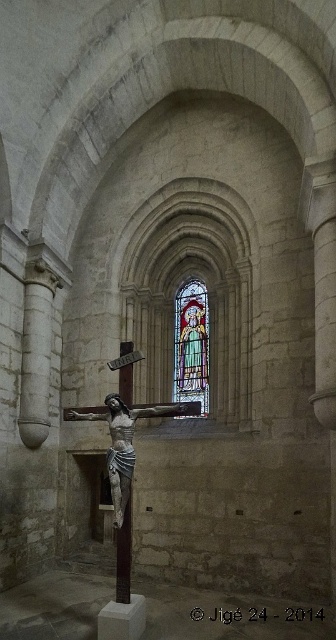
You are standing in the historic church or cathedral. You want to locate the stained glass window at center. Where should you look?

You should look at point [191,344] to find the stained glass window at center.

You are an art student visiting the church and want to sketch both the stained glass window at center and the polished silver crucifix at center. Which object should you focus on first if you want to draw the larger one first?

The polished silver crucifix at center is larger than the stained glass window at center, so you should focus on drawing the polished silver crucifix at center first.